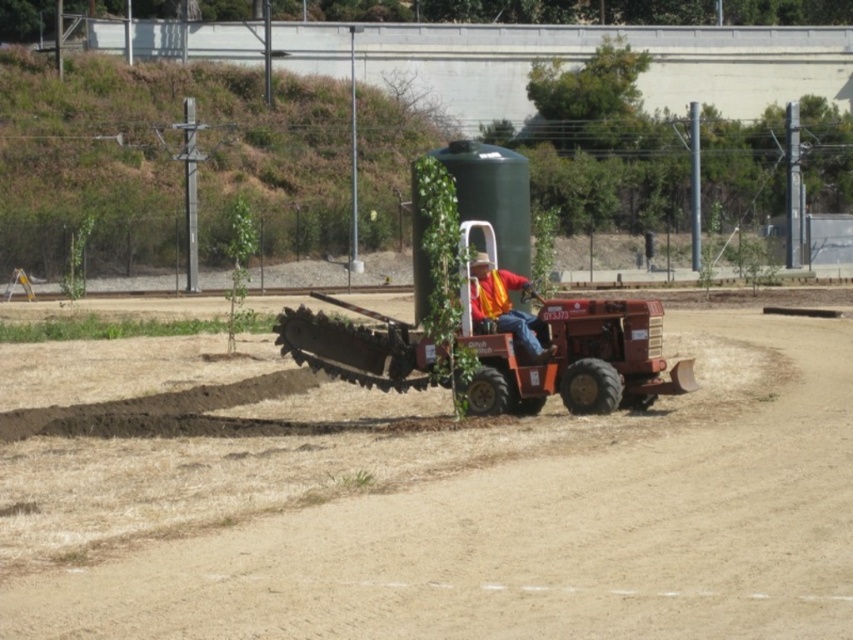
Is point (477, 392) closer to camera compared to point (469, 205)?

Yes, it is.

How distant is matte orange tractor at center from green matte water tank at center?

matte orange tractor at center is 32.50 feet away from green matte water tank at center.

This screenshot has height=640, width=853. Describe the element at coordinates (575, 358) in the screenshot. I see `matte orange tractor at center` at that location.

The height and width of the screenshot is (640, 853). What are the coordinates of `matte orange tractor at center` in the screenshot? It's located at (575, 358).

Based on the photo, measure the distance between point (752,502) and camera.

Point (752,502) and camera are 36.43 feet apart.

Who is higher up, brown dry soil at center or green matte water tank at center?

green matte water tank at center

The width and height of the screenshot is (853, 640). What are the coordinates of `brown dry soil at center` in the screenshot? It's located at (538, 529).

Where is `brown dry soil at center`? The height and width of the screenshot is (640, 853). brown dry soil at center is located at coordinates (538, 529).

Does green matte water tank at center have a lesser height compared to orange reflective vest at center?

No.

Is the position of green matte water tank at center more distant than that of orange reflective vest at center?

No.

I want to click on green matte water tank at center, so click(492, 195).